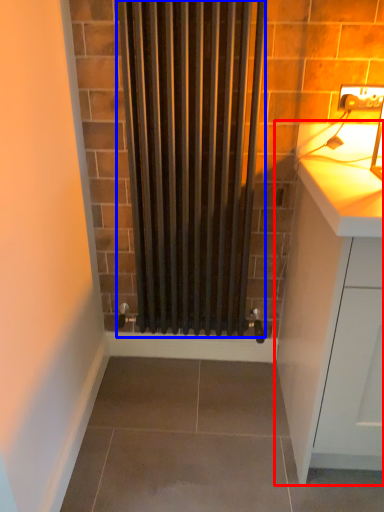
Question: Which object is further to the camera taking this photo, cabinetry (highlighted by a red box) or shower curtain (highlighted by a blue box)?

Choices:
 (A) cabinetry
 (B) shower curtain

Answer: (B)